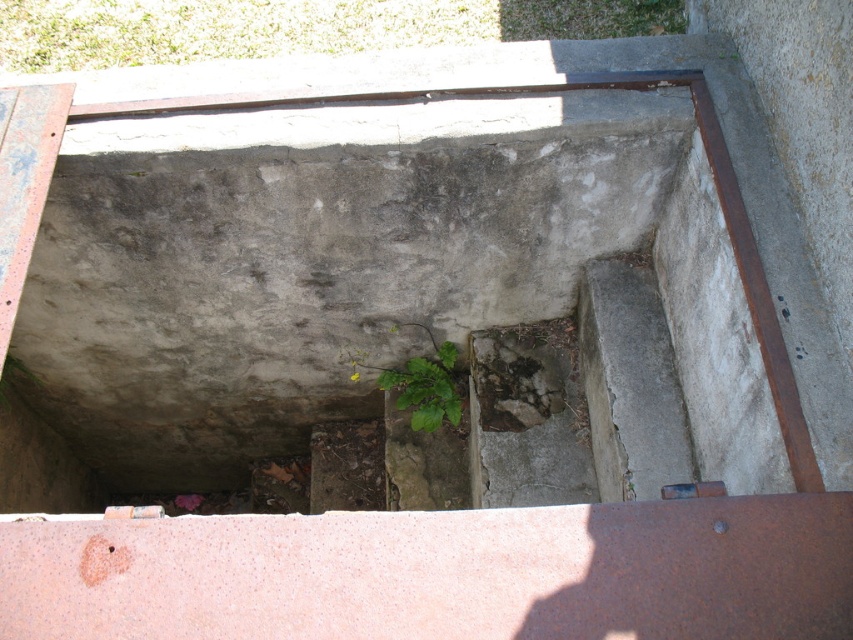
Question: Observing the image, what is the correct spatial positioning of concrete/stained at right in reference to brown rough stone hole at center?

Choices:
 (A) left
 (B) right

Answer: (B)

Question: Which point is closer to the camera?

Choices:
 (A) green leafy plant at upper center
 (B) concrete/stained at right
 (C) green leafy plant at center

Answer: (B)

Question: Based on their relative distances, which object is nearer to the green leafy plant at upper center?

Choices:
 (A) green leafy plant at center
 (B) brown rough stone hole at center

Answer: (B)

Question: Which is farther from the brown rough stone hole at center?

Choices:
 (A) green leafy plant at upper center
 (B) green leafy plant at center
 (C) concrete/stained at right

Answer: (A)

Question: Does brown rough stone hole at center appear under green leafy plant at center?

Choices:
 (A) no
 (B) yes

Answer: (A)

Question: Is green leafy plant at upper center wider than concrete/stained at right?

Choices:
 (A) yes
 (B) no

Answer: (A)